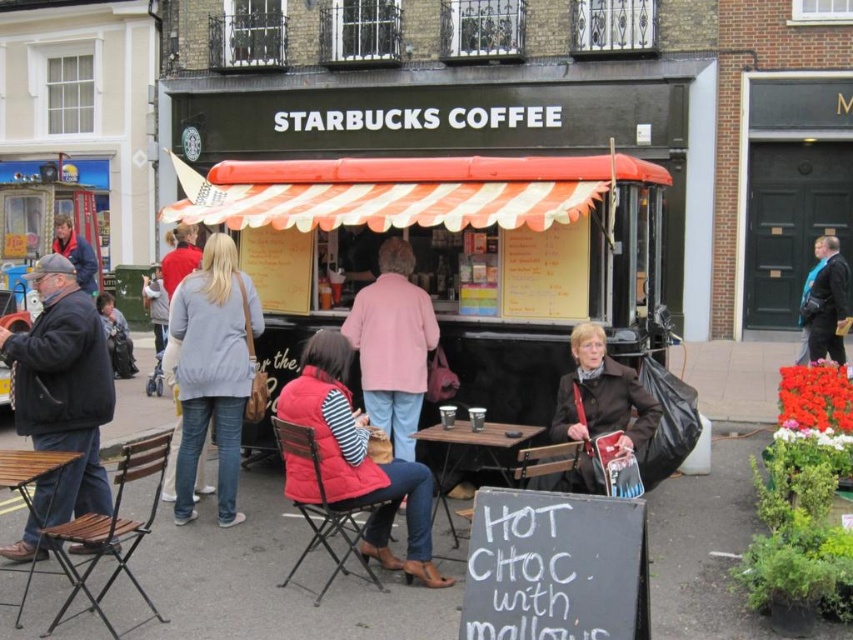
You are a pedestrian standing on the sidewalk looking at the black matte food truck at center and the matte black jacket at lower left. Which object is closer to you?

The black matte food truck at center is closer to you because it is positioned in front of the matte black jacket at lower left.

You are a customer standing in front of the black matte food truck at center and the light gray cotton jacket at center. Which object is taller?

The black matte food truck at center is taller than the light gray cotton jacket at center.

Looking at this image, you are standing on the street and see the black matte food truck at center and the matte black jacket at lower left. Which object is positioned to the right of the other?

The black matte food truck at center is positioned to the right of the matte black jacket at lower left.